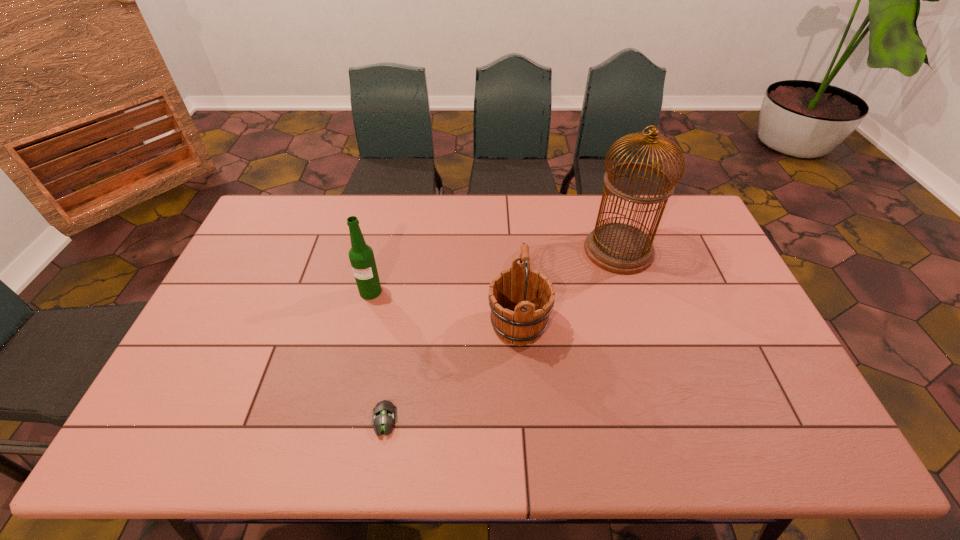
You are a GUI agent. You are given a task and a screenshot of the screen. Output one action in this format:
    pyautogui.click(x=<x>, y=<y>)
    Task: Click on the free region located 0.160m on the label of the beer bottle
    The image size is (960, 540).
    Given the screenshot: What is the action you would take?
    pyautogui.click(x=358, y=344)

Find the location of a particular element. Image resolution: width=960 pixels, height=540 pixels. vacant region located on the back of the second object from left to right is located at coordinates (399, 329).

Where is `object at the far edge`? This screenshot has width=960, height=540. object at the far edge is located at coordinates (619, 248).

Identify the location of object present at the near edge. This screenshot has width=960, height=540. (384, 416).

Identify the location of vacant region at the far edge of the desktop. The image size is (960, 540). (321, 197).

This screenshot has height=540, width=960. I want to click on vacant space at the near edge of the desktop, so click(x=618, y=422).

Find the location of a particular element. The width and height of the screenshot is (960, 540). free spot at the right edge of the desktop is located at coordinates (698, 259).

In the image, there is a desktop. Identify the location of vacant region at the far left corner. This screenshot has width=960, height=540. (291, 215).

This screenshot has width=960, height=540. In the image, there is a desktop. Find the location of `free space at the near left corner`. free space at the near left corner is located at coordinates (165, 441).

Image resolution: width=960 pixels, height=540 pixels. In the image, there is a desktop. Find the location of `free space at the far right corner`. free space at the far right corner is located at coordinates (663, 215).